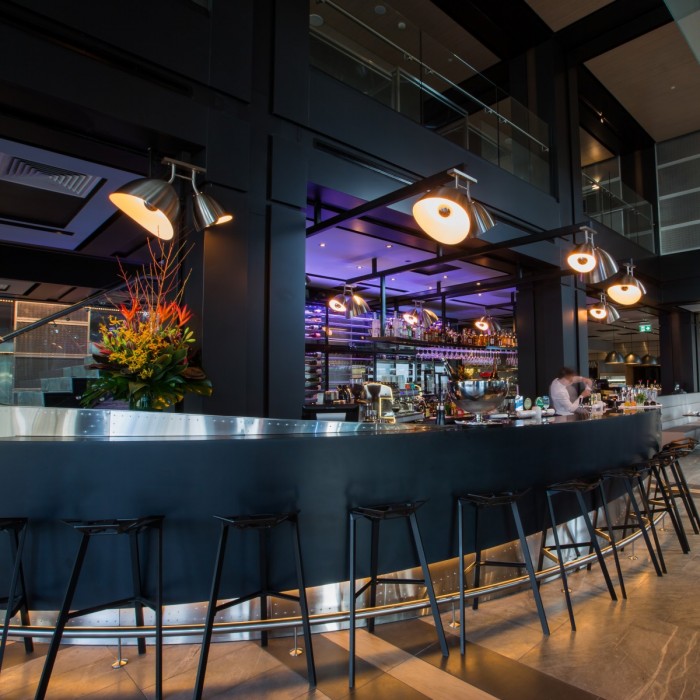
At what (x,y) coordinates should I click in order to perform the action: click on flooring. Please return your answer as a coordinate pair (x, y). The image size is (700, 700). Looking at the image, I should click on (636, 676).